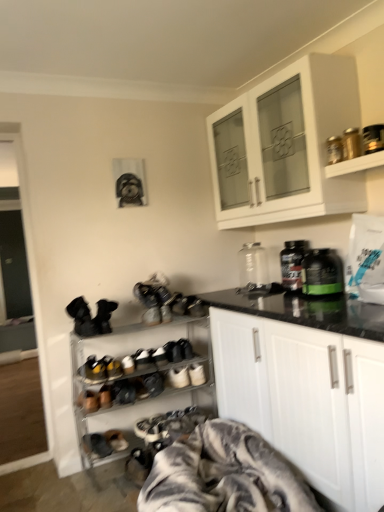
Question: Could white matte cabinet at center, which is counted as the first cabinetry, starting from the bottom, be considered to be inside green matte bottle at right, the 3th bottle positioned from the back?

Choices:
 (A) yes
 (B) no

Answer: (B)

Question: Considering the relative positions of green matte bottle at right, arranged as the 1th bottle when viewed from the front, and white matte cabinet at center, which is counted as the first cabinetry, starting from the bottom, in the image provided, is green matte bottle at right, arranged as the 1th bottle when viewed from the front, to the left of white matte cabinet at center, which is counted as the first cabinetry, starting from the bottom, from the viewer's perspective?

Choices:
 (A) no
 (B) yes

Answer: (A)

Question: Can you confirm if green matte bottle at right, the 3th bottle positioned from the back, is wider than white matte cabinet at center, which appears as the 2th cabinetry when viewed from the top?

Choices:
 (A) no
 (B) yes

Answer: (A)

Question: Does green matte bottle at right, arranged as the 1th bottle when viewed from the front, have a lesser height compared to white matte cabinet at center, which is counted as the first cabinetry, starting from the bottom?

Choices:
 (A) yes
 (B) no

Answer: (A)

Question: Is green matte bottle at right, the 3th bottle positioned from the back, completely or partially outside of white matte cabinet at center, which appears as the 2th cabinetry when viewed from the top?

Choices:
 (A) yes
 (B) no

Answer: (A)

Question: Does green matte bottle at right, the 3th bottle positioned from the back, touch white matte cabinet at center, which is counted as the first cabinetry, starting from the bottom?

Choices:
 (A) no
 (B) yes

Answer: (A)

Question: Is white matte cabinet at upper center, which is the second cabinetry in bottom-to-top order, beside leather sneakers at center, the 1th footwear positioned from the bottom?

Choices:
 (A) yes
 (B) no

Answer: (B)

Question: Does white matte cabinet at upper center, which is the second cabinetry in bottom-to-top order, have a lesser width compared to leather sneakers at center, which is the second footwear in right-to-left order?

Choices:
 (A) yes
 (B) no

Answer: (B)

Question: Could leather sneakers at center, which is the second footwear in right-to-left order, be considered to be inside white matte cabinet at upper center, arranged as the first cabinetry when viewed from the top?

Choices:
 (A) no
 (B) yes

Answer: (A)

Question: Is white matte cabinet at upper center, which is the second cabinetry in bottom-to-top order, oriented towards leather sneakers at center, the 1th footwear positioned from the bottom?

Choices:
 (A) no
 (B) yes

Answer: (A)

Question: From the image's perspective, would you say white matte cabinet at upper center, arranged as the first cabinetry when viewed from the top, is shown under leather sneakers at center, the third footwear from the left?

Choices:
 (A) yes
 (B) no

Answer: (B)

Question: Does white matte cabinet at upper center, arranged as the first cabinetry when viewed from the top, have a smaller size compared to leather sneakers at center, the third footwear from the left?

Choices:
 (A) no
 (B) yes

Answer: (A)

Question: Does white matte cabinet at upper center, arranged as the first cabinetry when viewed from the top, have a larger size compared to black plastic bottle at center, the 2th bottle from the back?

Choices:
 (A) yes
 (B) no

Answer: (A)